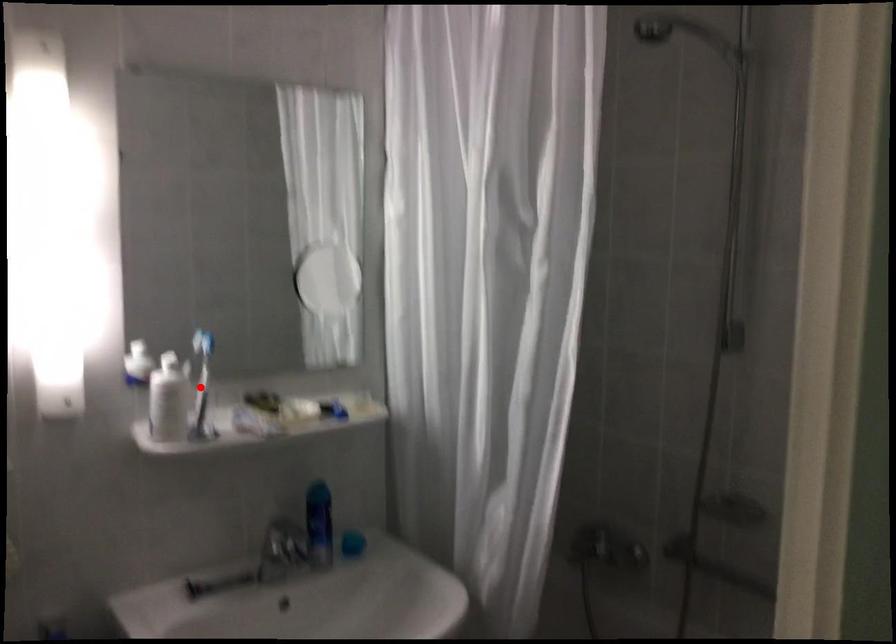
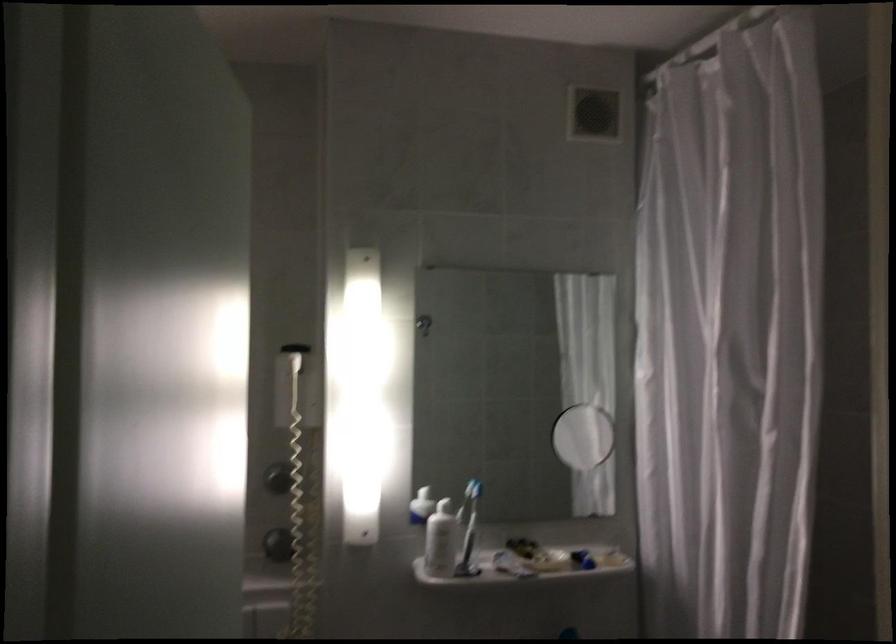
Find the pixel in the second image that matches the highlighted location in the first image.

(469, 529)